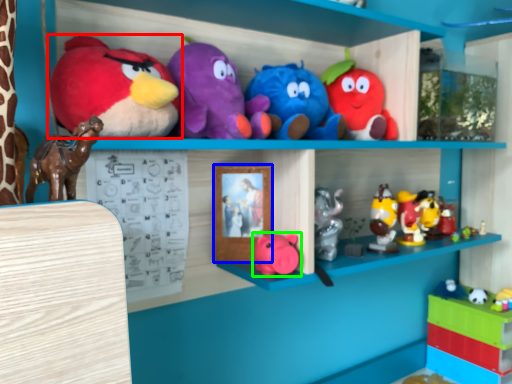
Question: Considering the real-world distances, which object is farthest from toy (highlighted by a red box)? picture frame (highlighted by a blue box) or toy (highlighted by a green box)?

Choices:
 (A) picture frame
 (B) toy

Answer: (B)